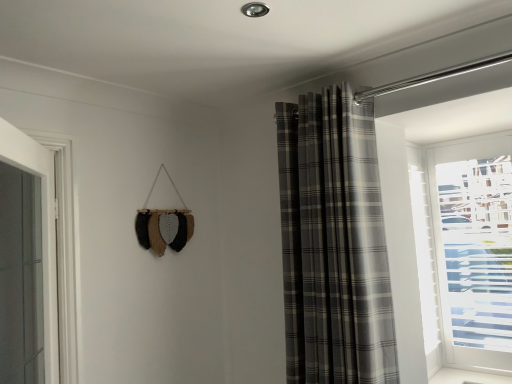
Question: Does point (357, 233) appear closer or farther from the camera than point (42, 221)?

Choices:
 (A) farther
 (B) closer

Answer: (A)

Question: Is plaid fabric curtain at upper right to the left or to the right of white glossy door at left in the image?

Choices:
 (A) right
 (B) left

Answer: (A)

Question: In terms of width, does plaid fabric curtain at upper right look wider or thinner when compared to white glossy door at left?

Choices:
 (A) thin
 (B) wide

Answer: (B)

Question: Is white glossy door at left situated inside plaid fabric curtain at upper right or outside?

Choices:
 (A) inside
 (B) outside

Answer: (B)

Question: From a real-world perspective, relative to plaid fabric curtain at upper right, is white glossy door at left vertically above or below?

Choices:
 (A) below
 (B) above

Answer: (A)

Question: Is white glossy door at left wider or thinner than plaid fabric curtain at upper right?

Choices:
 (A) thin
 (B) wide

Answer: (A)

Question: Is white glossy door at left bigger or smaller than plaid fabric curtain at upper right?

Choices:
 (A) small
 (B) big

Answer: (A)